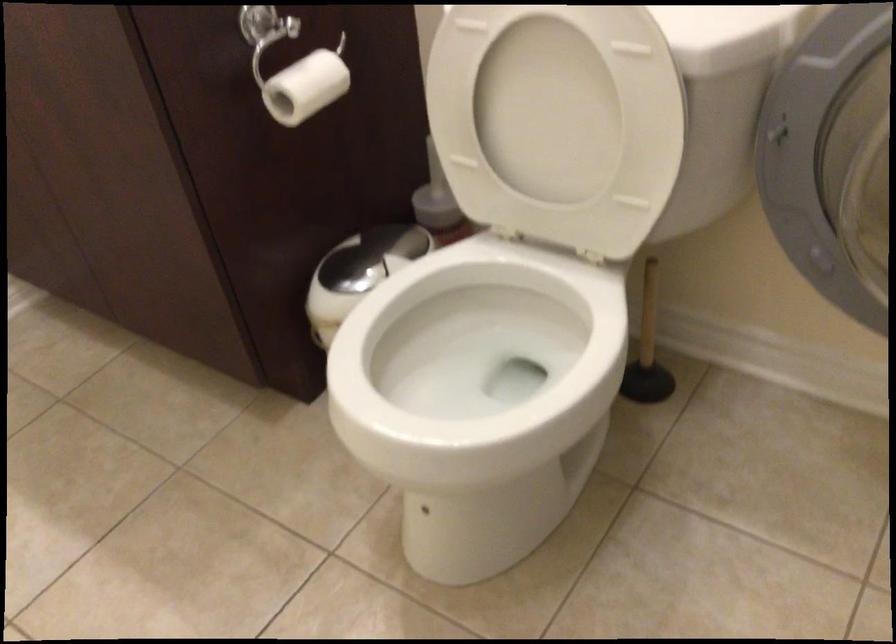
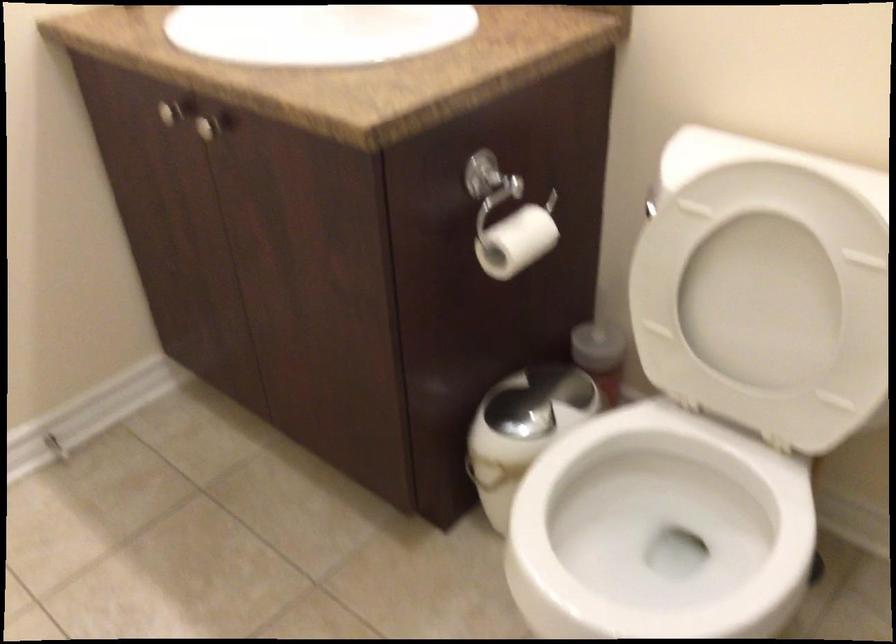
Locate, in the second image, the point that corresponds to (362,272) in the first image.

(529, 413)